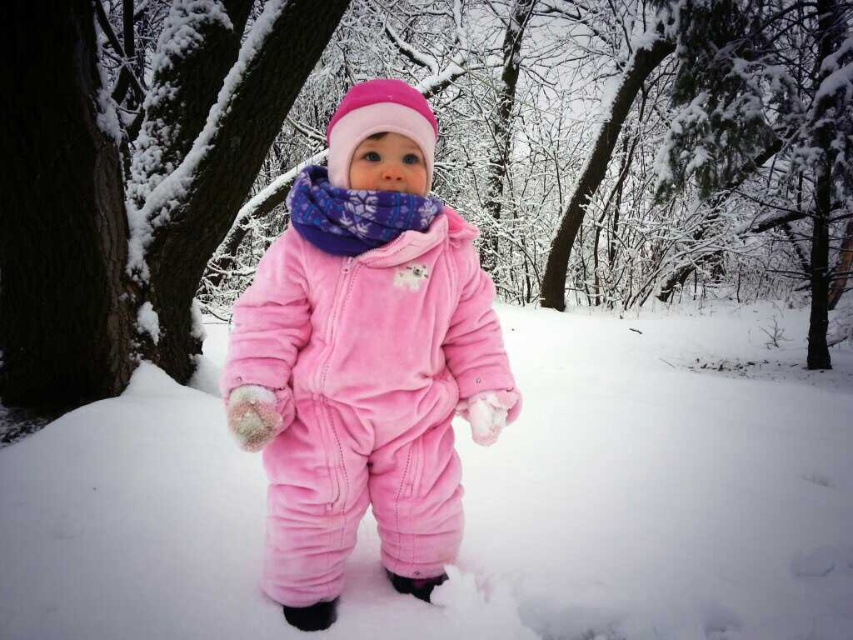
You are a photographer trying to capture the child in the snowy forest. You notice the velvety pink snowsuit at center and the velvet pink snowsuit at center. Which one is positioned lower in the image?

The velvety pink snowsuit at center is positioned lower than the velvet pink snowsuit at center.